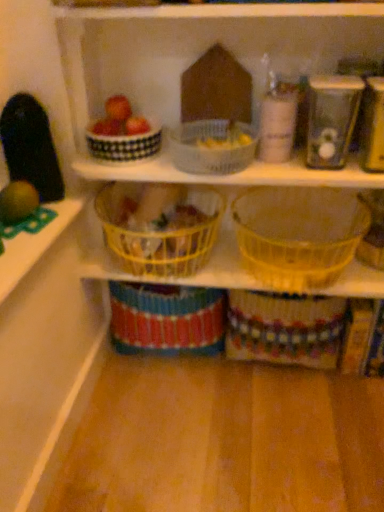
Question: In terms of width, does metallic silver canister at upper right, which is counted as the 2th appliance, starting from the right, look wider or thinner when compared to yellow plastic basket at center, the third basket viewed from the right?

Choices:
 (A) thin
 (B) wide

Answer: (A)

Question: Visually, is metallic silver canister at upper right, which is counted as the 2th appliance, starting from the right, positioned to the left or to the right of yellow plastic basket at center, placed as the second basket when sorted from left to right?

Choices:
 (A) right
 (B) left

Answer: (A)

Question: Estimate the real-world distances between objects in this image. Which object is farther from the yellow plastic basket at center, the third basket viewed from the right?

Choices:
 (A) matte red apple at upper left
 (B) metallic silver toaster at upper right, marked as the first appliance in a right-to-left arrangement
 (C) white checkered basket at upper center, the 4th basket when ordered from right to left
 (D) metallic silver canister at upper right, which is counted as the 2th appliance, starting from the right
 (E) translucent plastic basket at center, positioned as the fourth basket in left-to-right order

Answer: (B)

Question: Which object is positioned closest to the matte red apple at upper left?

Choices:
 (A) white checkered basket at upper center, which ranks as the first basket in left-to-right order
 (B) translucent plastic basket at center, which is the second basket from right to left
 (C) translucent plastic basket at center, positioned as the fourth basket in left-to-right order
 (D) metallic silver canister at upper right, which is counted as the 2th appliance, starting from the right
 (E) metallic silver toaster at upper right, which ranks as the 2th appliance in left-to-right order

Answer: (A)